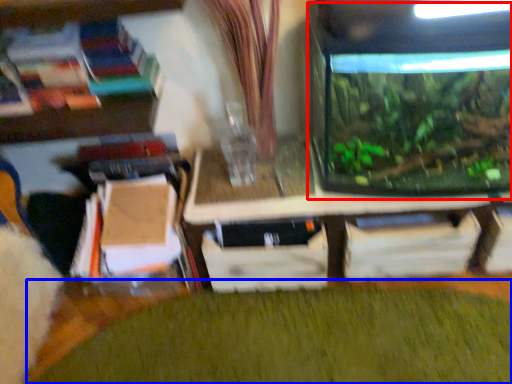
Question: Among these objects, which one is farthest to the camera, glass box (highlighted by a red box) or plant (highlighted by a blue box)?

Choices:
 (A) glass box
 (B) plant

Answer: (B)